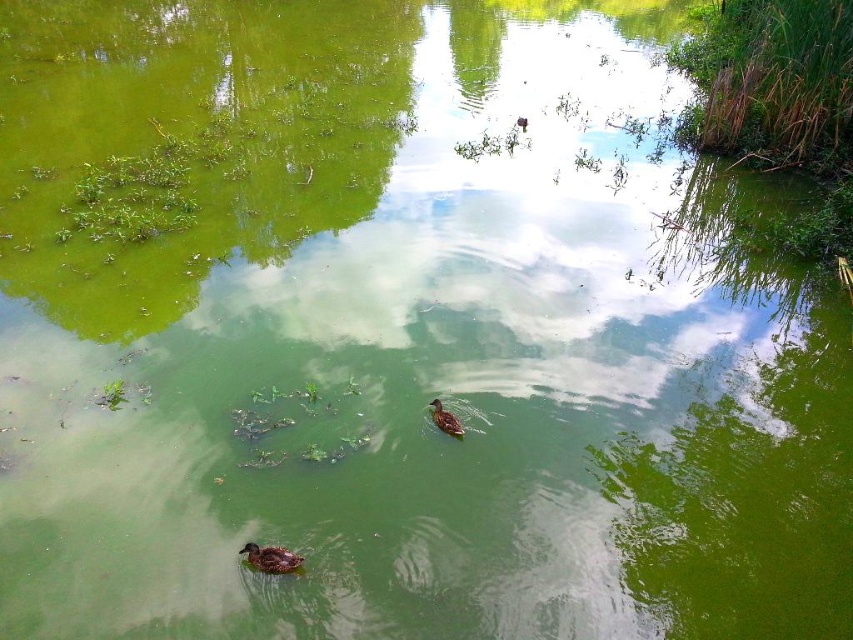
Does brown fuzzy duckling at lower left appear on the right side of brown feathered duck at center?

Incorrect, brown fuzzy duckling at lower left is not on the right side of brown feathered duck at center.

Between point (239, 548) and point (444, 426), which one is positioned in front?

Point (239, 548) is in front.

Which is behind, point (283, 566) or point (438, 412)?

Positioned behind is point (438, 412).

Image resolution: width=853 pixels, height=640 pixels. In order to click on brown fuzzy duckling at lower left in this screenshot , I will do `click(271, 557)`.